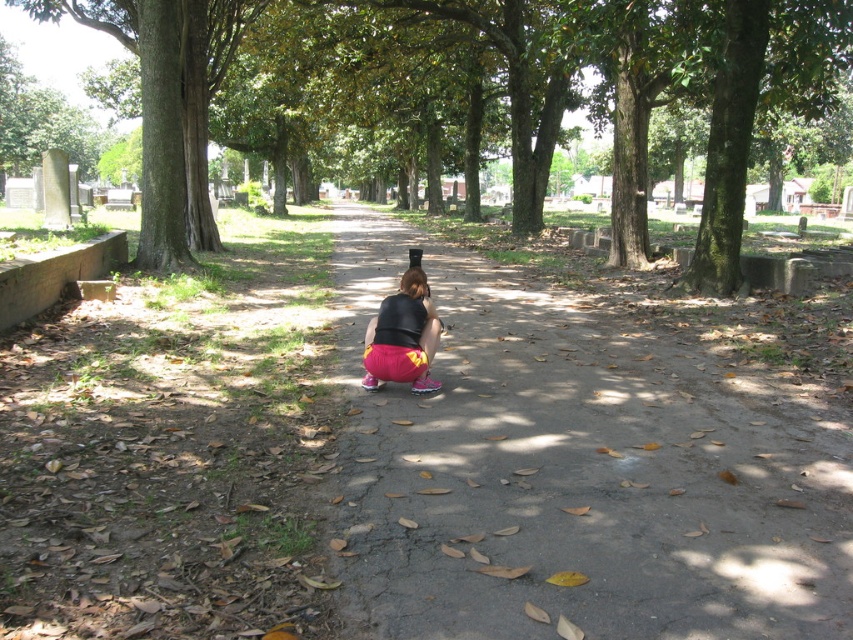
You are a photographer standing at the edge of the cemetery pathway. You want to take a photo that includes both the green rough bark tree at center and the pink matte shorts at center. Which object should you adjust your camera focus on first to ensure both are in the frame?

The green rough bark tree at center is further to the viewer than the pink matte shorts at center, so focus on the pink matte shorts at center first to ensure both are in the frame.

You are standing at the entrance of the cemetery and see the green rough bark tree at center and the pink matte shorts at center. Which object is closer to your eye level?

The green rough bark tree at center is taller than the pink matte shorts at center, so the pink matte shorts at center is closer to your eye level.